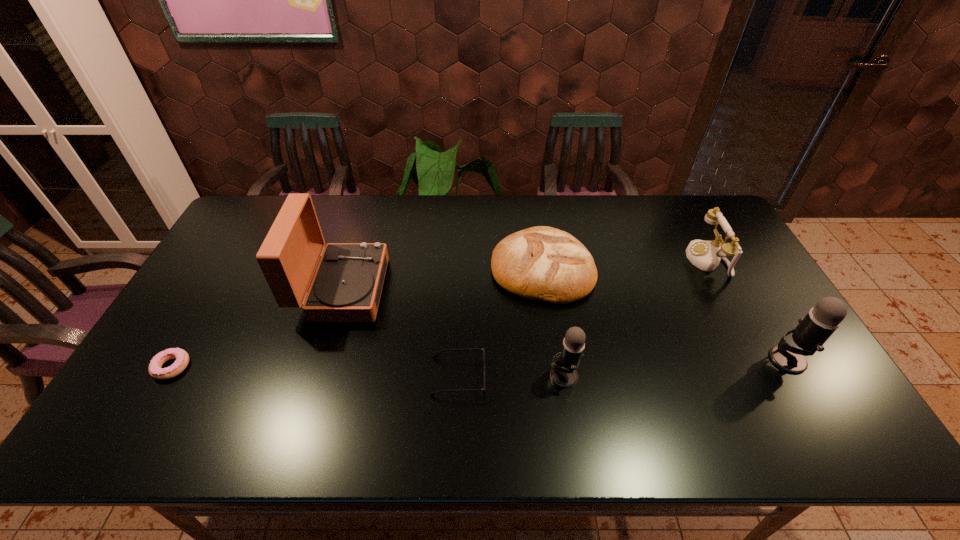
Where is `the left microphone`? the left microphone is located at coordinates (563, 373).

At what (x,y) coordinates should I click in order to perform the action: click on the shorter microphone. Please return your answer as a coordinate pair (x, y). Looking at the image, I should click on (563, 373).

Locate an element on the screen. the taller microphone is located at coordinates (813, 330).

This screenshot has height=540, width=960. Identify the location of the fourth tallest object. (706, 255).

The width and height of the screenshot is (960, 540). Identify the location of the second object from left to right. (346, 287).

Locate an element on the screen. the fifth tallest object is located at coordinates (543, 263).

This screenshot has height=540, width=960. What are the coordinates of `doughnut` in the screenshot? It's located at (182, 358).

At what (x,y) coordinates should I click in order to perform the action: click on the leftmost object. Please return your answer as a coordinate pair (x, y). This screenshot has width=960, height=540. Looking at the image, I should click on (182, 358).

Where is `spectacles`? The image size is (960, 540). spectacles is located at coordinates (435, 356).

This screenshot has width=960, height=540. Find the location of `the third object from left to right`. the third object from left to right is located at coordinates (435, 356).